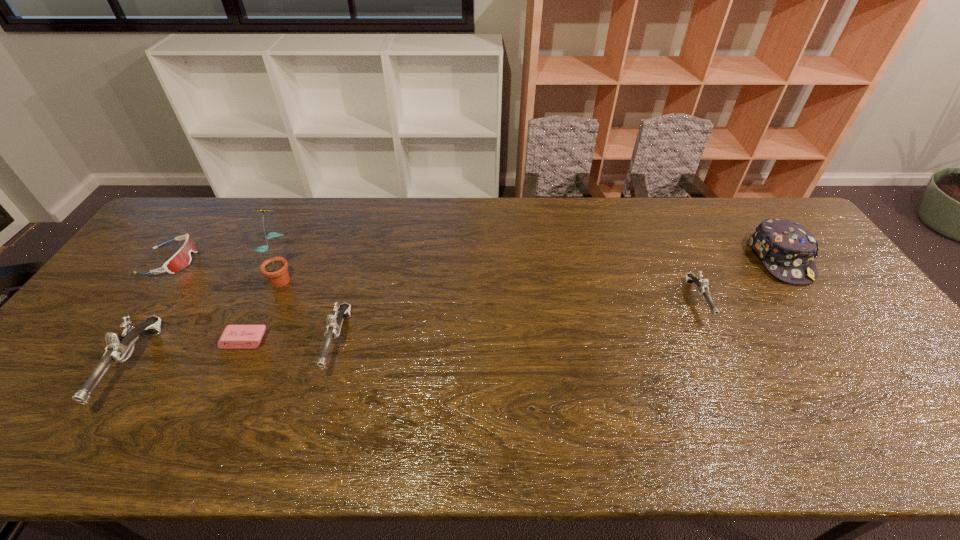
Find the location of `the tallest gun`. the tallest gun is located at coordinates (119, 348).

I want to click on the fifth object from left to right, so click(334, 322).

Identify the location of the second tallest gun. (334, 322).

In order to click on the rightmost gun in this screenshot , I will do `click(701, 285)`.

This screenshot has height=540, width=960. Find the location of `the shortest gun`. the shortest gun is located at coordinates (701, 285).

What are the coordinates of `the rightmost object` in the screenshot? It's located at (787, 250).

This screenshot has width=960, height=540. I want to click on sunflower, so click(x=275, y=268).

Find the location of `goggles`. goggles is located at coordinates (182, 258).

I want to click on the shortest object, so click(234, 336).

Where is `free space located aimed along the barrel of the third object from right to left`? The image size is (960, 540). free space located aimed along the barrel of the third object from right to left is located at coordinates (320, 407).